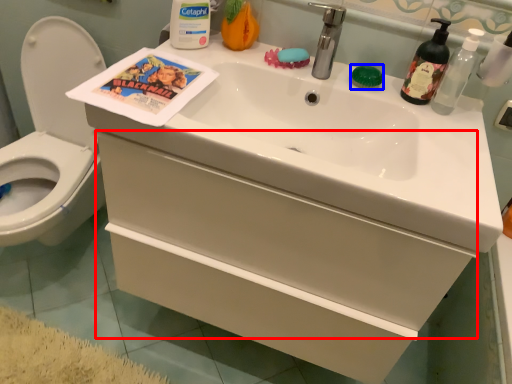
Question: Which point is further to the camera, drawer (highlighted by a red box) or soap (highlighted by a blue box)?

Choices:
 (A) drawer
 (B) soap

Answer: (B)